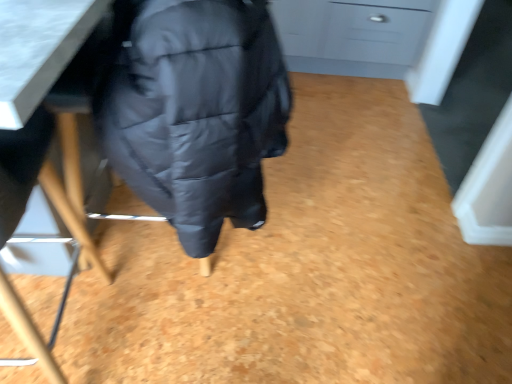
Locate an element on the screen. free space in front of matte gray drawer at upper right is located at coordinates (362, 124).